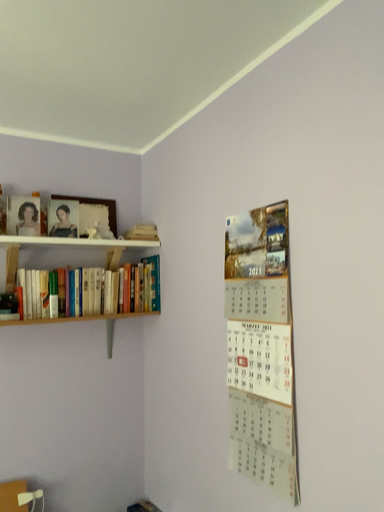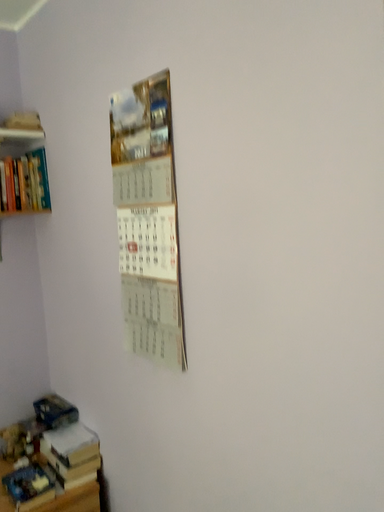
Question: How did the camera likely rotate when shooting the video?

Choices:
 (A) rotated right
 (B) rotated left

Answer: (A)